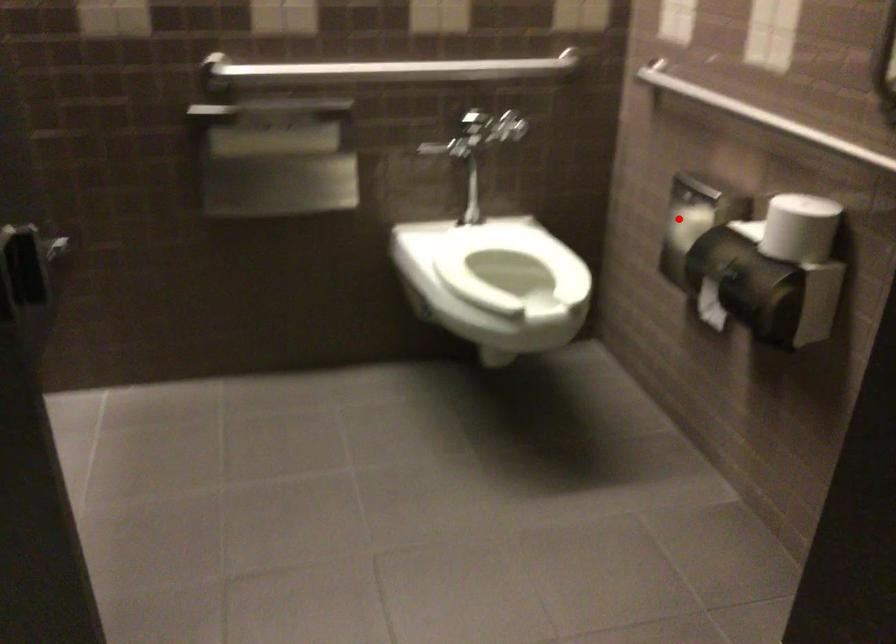
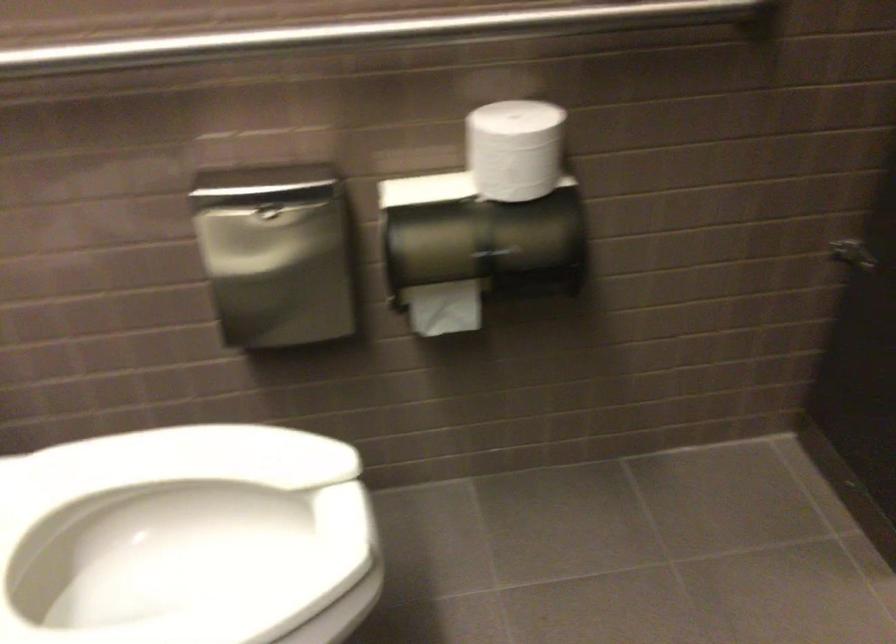
Question: I am providing you with two images of the same scene from different viewpoints. A red point is shown in image1. For the corresponding object point in image2, is it positioned nearer or farther from the camera?

Choices:
 (A) Nearer
 (B) Farther

Answer: (A)